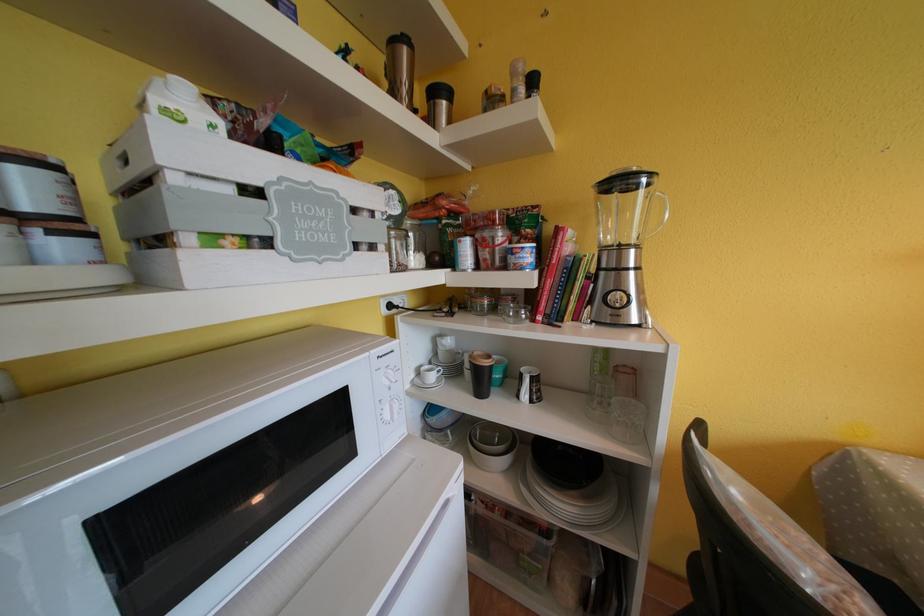
Image resolution: width=924 pixels, height=616 pixels. Describe the element at coordinates (492, 446) in the screenshot. I see `the small white bowl` at that location.